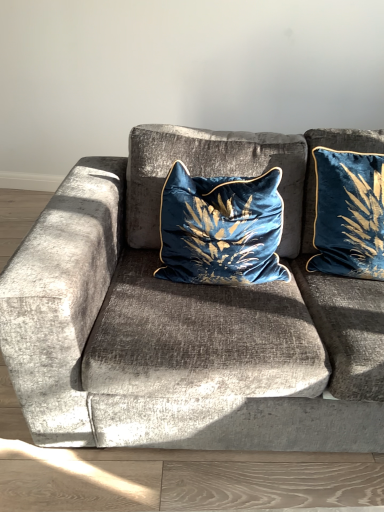
Question: Does velvet blue pillow at center, which ranks as the 1th pillow in left-to-right order, have a lesser width compared to velvet blue pillow at upper right, which appears as the 2th pillow when viewed from the left?

Choices:
 (A) yes
 (B) no

Answer: (B)

Question: From a real-world perspective, is velvet blue pillow at center, which ranks as the 1th pillow in left-to-right order, beneath velvet blue pillow at upper right, which appears as the 2th pillow when viewed from the left?

Choices:
 (A) yes
 (B) no

Answer: (A)

Question: Is velvet blue pillow at center, the 2th pillow from the right, positioned beyond the bounds of velvet blue pillow at upper right, which is the first pillow from right to left?

Choices:
 (A) yes
 (B) no

Answer: (A)

Question: Does velvet blue pillow at center, which ranks as the 1th pillow in left-to-right order, have a smaller size compared to velvet blue pillow at upper right, which is the first pillow from right to left?

Choices:
 (A) yes
 (B) no

Answer: (B)

Question: Considering the relative sizes of velvet blue pillow at center, which ranks as the 1th pillow in left-to-right order, and velvet blue pillow at upper right, which appears as the 2th pillow when viewed from the left, in the image provided, is velvet blue pillow at center, which ranks as the 1th pillow in left-to-right order, bigger than velvet blue pillow at upper right, which appears as the 2th pillow when viewed from the left,?

Choices:
 (A) no
 (B) yes

Answer: (B)

Question: Is velvet cushion at center inside or outside of velvet blue pillow at upper right, which appears as the 2th pillow when viewed from the left?

Choices:
 (A) inside
 (B) outside

Answer: (B)

Question: Considering the positions of point (281, 424) and point (369, 241), is point (281, 424) closer or farther from the camera than point (369, 241)?

Choices:
 (A) farther
 (B) closer

Answer: (B)

Question: Looking at the image, does velvet cushion at center seem bigger or smaller compared to velvet blue pillow at upper right, which appears as the 2th pillow when viewed from the left?

Choices:
 (A) big
 (B) small

Answer: (A)

Question: Considering their positions, is velvet cushion at center located in front of or behind velvet blue pillow at upper right, which is the first pillow from right to left?

Choices:
 (A) behind
 (B) front

Answer: (B)

Question: Is point (355, 251) closer or farther from the camera than point (223, 244)?

Choices:
 (A) closer
 (B) farther

Answer: (B)

Question: Would you say velvet blue pillow at upper right, which is the first pillow from right to left, is to the left or to the right of velvet blue pillow at center, the 2th pillow from the right, in the picture?

Choices:
 (A) right
 (B) left

Answer: (A)

Question: From a real-world perspective, is velvet blue pillow at upper right, which is the first pillow from right to left, positioned above or below velvet blue pillow at center, which ranks as the 1th pillow in left-to-right order?

Choices:
 (A) above
 (B) below

Answer: (A)

Question: Which is correct: velvet blue pillow at upper right, which is the first pillow from right to left, is inside velvet blue pillow at center, the 2th pillow from the right, or outside of it?

Choices:
 (A) inside
 (B) outside

Answer: (B)

Question: From the image's perspective, is velvet cushion at center located above or below velvet blue pillow at center, which ranks as the 1th pillow in left-to-right order?

Choices:
 (A) above
 (B) below

Answer: (B)

Question: From a real-world perspective, relative to velvet blue pillow at center, which ranks as the 1th pillow in left-to-right order, is velvet cushion at center vertically above or below?

Choices:
 (A) above
 (B) below

Answer: (B)